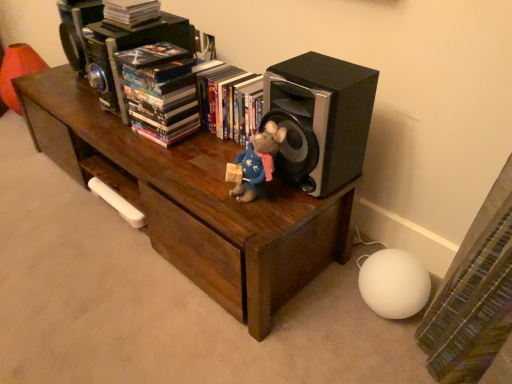
The height and width of the screenshot is (384, 512). What are the coordinates of `free space on the front side of brown wood table at center` in the screenshot? It's located at (142, 302).